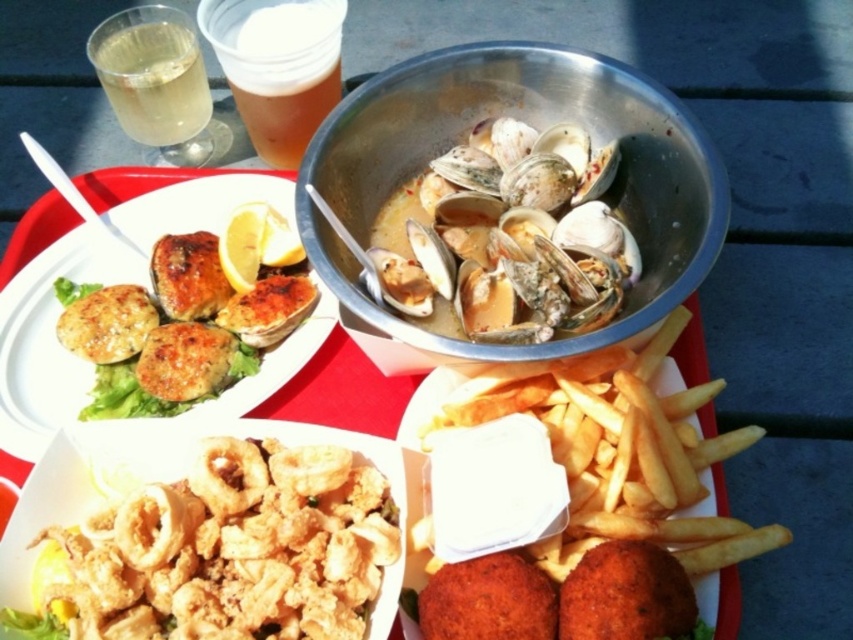
You are a food critic evaluating this seafood meal. You need to describe the arrangement of the golden crispy calamari at center and the golden brown crusty fish cakes at upper left. Which one is placed to the right of the other?

The golden crispy calamari at center is positioned on the right side of golden brown crusty fish cakes at upper left.

You are a food critic standing 36 inches away from the table. You want to taste the golden brown crusty fish cakes at upper left. Can you reach them without moving closer?

The golden brown crusty fish cakes at upper left is 35.22 inches from viewer, so yes, you can reach them without moving closer since you are only 36 inches away, which is just slightly farther than the distance to the dish.

You are a food critic analyzing the arrangement of dishes on the red tray. Based on the height of the shiny white shells at center and the golden brown crusty fish cakes at upper left, which dish would you estimate occupies more vertical space on the tray?

The shiny white shells at center is taller than golden brown crusty fish cakes at upper left, so the shiny white shells at center occupies more vertical space on the tray.